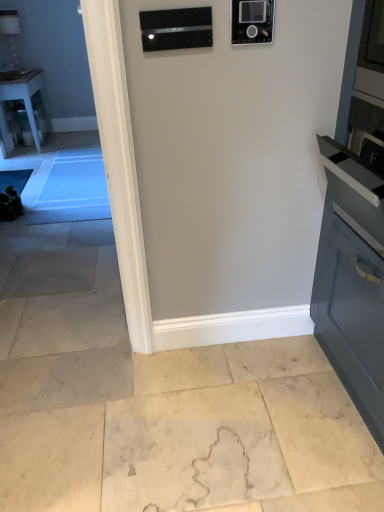
Question: Is beige marble floor at lower center inside or outside of clear glass table at left?

Choices:
 (A) outside
 (B) inside

Answer: (A)

Question: Considering the positions of beige marble floor at lower center and clear glass table at left in the image, is beige marble floor at lower center wider or thinner than clear glass table at left?

Choices:
 (A) thin
 (B) wide

Answer: (B)

Question: Based on their relative distances, which object is farther from the clear glass table at left?

Choices:
 (A) black glass microwave at upper center, placed as the 2th appliance when sorted from right to left
 (B) black glossy microwave at upper center, which is counted as the 2th appliance, starting from the left
 (C) beige marble floor at lower center

Answer: (B)

Question: Which of these objects is positioned closest to the clear glass table at left?

Choices:
 (A) black glossy microwave at upper center, which ranks as the 1th appliance in right-to-left order
 (B) beige marble floor at lower center
 (C) black glass microwave at upper center, placed as the 2th appliance when sorted from right to left

Answer: (C)